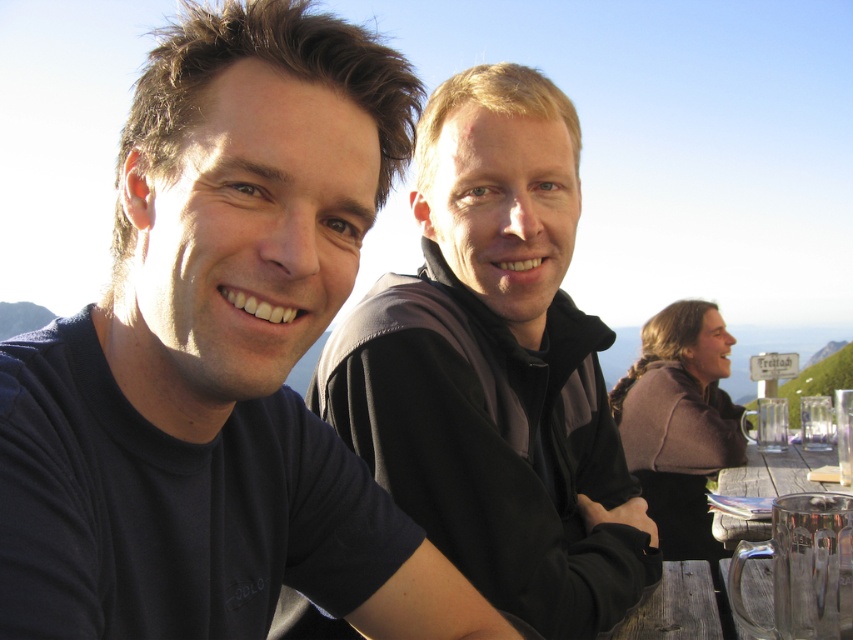
Question: Which of these objects is positioned closest to the dark blue t-shirt at left?

Choices:
 (A) clear glass mug at lower right
 (B) wooden table at lower right
 (C) matte black jacket at center

Answer: (A)

Question: Can you confirm if wooden table at lower center is thinner than wooden table at lower right?

Choices:
 (A) yes
 (B) no

Answer: (A)

Question: Can you confirm if matte black jacket at center is positioned below clear glass mug at lower right?

Choices:
 (A) no
 (B) yes

Answer: (A)

Question: Considering the real-world distances, which object is farthest from the matte black jacket at center?

Choices:
 (A) wooden table at lower right
 (B) dark blue t-shirt at left
 (C) wooden table at lower center

Answer: (A)

Question: Is matte black jacket at center positioned in front of wooden table at lower right?

Choices:
 (A) no
 (B) yes

Answer: (B)

Question: Among these points, which one is farthest from the camera?

Choices:
 (A) (798, 458)
 (B) (682, 566)
 (C) (782, 577)

Answer: (A)